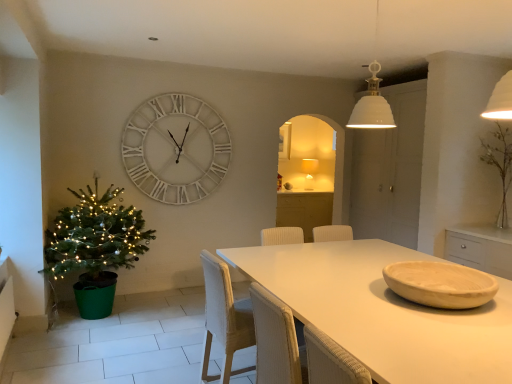
Question: Is matte white lampshade at center wider than white matte table at center?

Choices:
 (A) no
 (B) yes

Answer: (A)

Question: Can you confirm if matte white lampshade at center is positioned to the right of white matte table at center?

Choices:
 (A) no
 (B) yes

Answer: (B)

Question: Considering the relative sizes of matte white lampshade at center and white matte table at center in the image provided, is matte white lampshade at center thinner than white matte table at center?

Choices:
 (A) yes
 (B) no

Answer: (A)

Question: Are matte white lampshade at center and white matte table at center making contact?

Choices:
 (A) yes
 (B) no

Answer: (B)

Question: Does matte white lampshade at center have a smaller size compared to white matte table at center?

Choices:
 (A) no
 (B) yes

Answer: (B)

Question: Would you say white matte table at center is part of matte white lampshade at center's contents?

Choices:
 (A) yes
 (B) no

Answer: (B)

Question: Considering the relative sizes of woven white chair at center and matte white lampshade at center in the image provided, is woven white chair at center bigger than matte white lampshade at center?

Choices:
 (A) yes
 (B) no

Answer: (A)

Question: From the image's perspective, is woven white chair at center under matte white lampshade at center?

Choices:
 (A) yes
 (B) no

Answer: (A)

Question: Can you confirm if woven white chair at center is positioned to the left of matte white lampshade at center?

Choices:
 (A) yes
 (B) no

Answer: (A)

Question: From a real-world perspective, is woven white chair at center located higher than matte white lampshade at center?

Choices:
 (A) no
 (B) yes

Answer: (A)

Question: Can you confirm if woven white chair at center is wider than matte white lampshade at center?

Choices:
 (A) no
 (B) yes

Answer: (B)

Question: Does woven white chair at center have a lesser width compared to matte white lampshade at center?

Choices:
 (A) no
 (B) yes

Answer: (A)

Question: Does woven white chair at center have a lesser height compared to woven beige armchair at center?

Choices:
 (A) yes
 (B) no

Answer: (B)